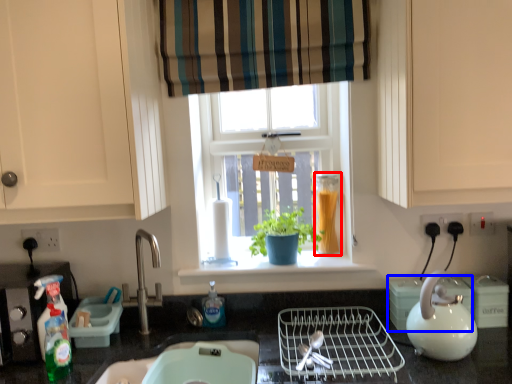
Question: Which object is closer to the camera taking this photo, glass jar (highlighted by a red box) or appliance (highlighted by a blue box)?

Choices:
 (A) glass jar
 (B) appliance

Answer: (B)